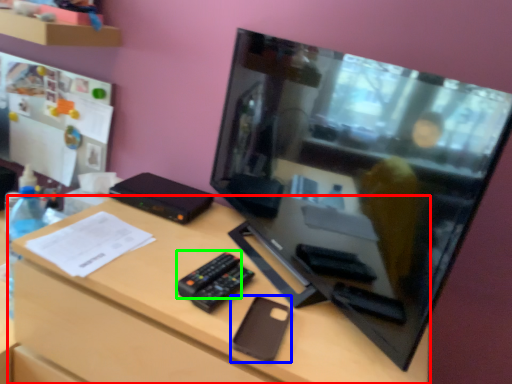
Question: Which object is positioned farthest from desk (highlighted by a red box)? Select from gadget (highlighted by a blue box) and remote (highlighted by a green box).

Choices:
 (A) gadget
 (B) remote

Answer: (A)